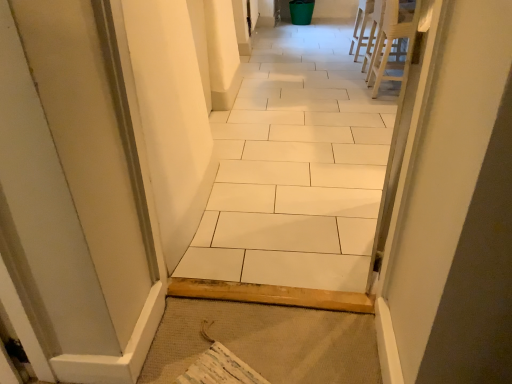
Question: Are white ceramic tile at center and white plastic chair at upper right, the 1th chair when ordered from front to back, located far from each other?

Choices:
 (A) no
 (B) yes

Answer: (A)

Question: Is white ceramic tile at center taller than white plastic chair at upper right, placed as the 2th chair when sorted from back to front?

Choices:
 (A) yes
 (B) no

Answer: (A)

Question: Is white ceramic tile at center closer to camera compared to white plastic chair at upper right, the 1th chair when ordered from front to back?

Choices:
 (A) no
 (B) yes

Answer: (B)

Question: Is white ceramic tile at center further to the viewer compared to white plastic chair at upper right, the 1th chair when ordered from front to back?

Choices:
 (A) no
 (B) yes

Answer: (A)

Question: From the image's perspective, is white ceramic tile at center below white plastic chair at upper right, the 1th chair when ordered from front to back?

Choices:
 (A) yes
 (B) no

Answer: (A)

Question: Does white ceramic tile at center have a greater width compared to white plastic chair at upper right, placed as the 2th chair when sorted from back to front?

Choices:
 (A) no
 (B) yes

Answer: (A)

Question: From a real-world perspective, is white plastic chair at upper right, which ranks as the second chair in front-to-back order, positioned under white plastic chair at upper right, placed as the 2th chair when sorted from back to front, based on gravity?

Choices:
 (A) no
 (B) yes

Answer: (B)

Question: Does white plastic chair at upper right, which appears as the first chair when viewed from the back, lie behind white plastic chair at upper right, the 1th chair when ordered from front to back?

Choices:
 (A) no
 (B) yes

Answer: (B)

Question: Is white plastic chair at upper right, which ranks as the second chair in front-to-back order, at the left side of white plastic chair at upper right, placed as the 2th chair when sorted from back to front?

Choices:
 (A) yes
 (B) no

Answer: (B)

Question: Is white plastic chair at upper right, which ranks as the second chair in front-to-back order, not near white plastic chair at upper right, the 1th chair when ordered from front to back?

Choices:
 (A) no
 (B) yes

Answer: (A)

Question: Is white plastic chair at upper right, which appears as the first chair when viewed from the back, beside white plastic chair at upper right, the 1th chair when ordered from front to back?

Choices:
 (A) yes
 (B) no

Answer: (B)

Question: Is white plastic chair at upper right, which ranks as the second chair in front-to-back order, thinner than white plastic chair at upper right, placed as the 2th chair when sorted from back to front?

Choices:
 (A) no
 (B) yes

Answer: (B)

Question: From the image's perspective, is white plastic chair at upper right, which ranks as the second chair in front-to-back order, on white ceramic tile at center?

Choices:
 (A) no
 (B) yes

Answer: (B)